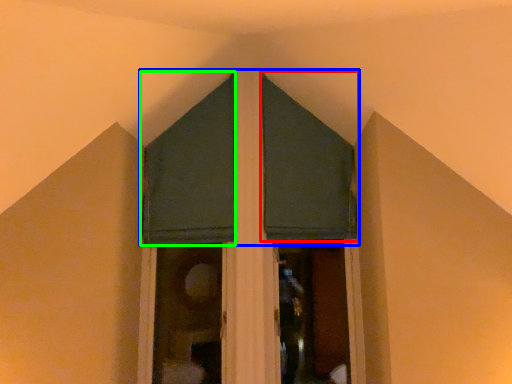
Question: Which is farther away from curtain (highlighted by a red box)? curtain (highlighted by a blue box) or curtain (highlighted by a green box)?

Choices:
 (A) curtain
 (B) curtain

Answer: (A)